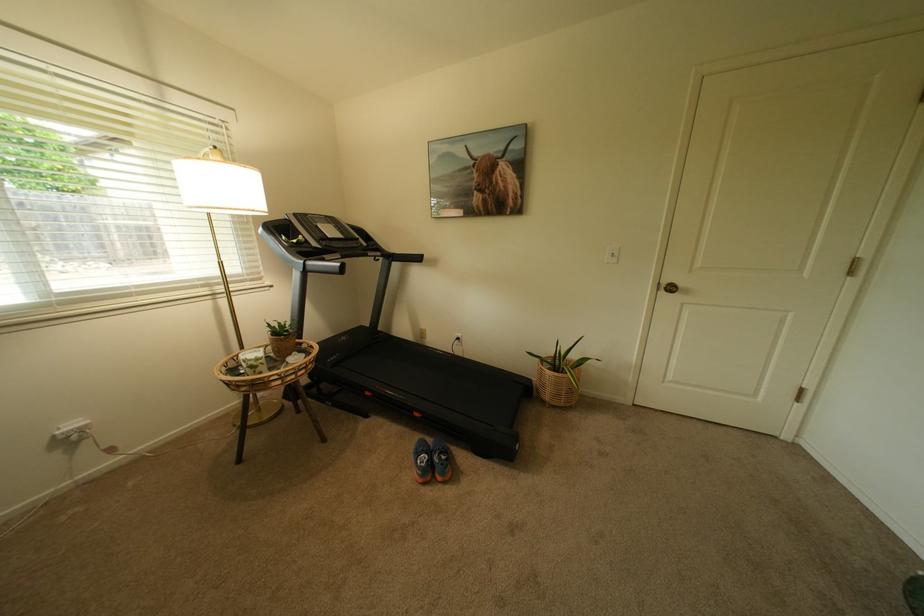
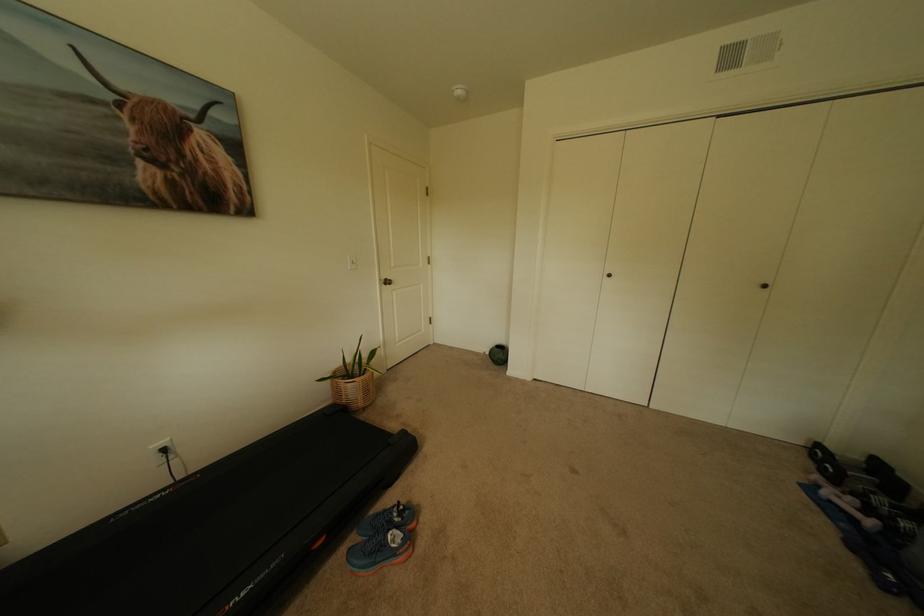
Locate, in the second image, the point that corresponds to (x=557, y=391) in the first image.

(370, 395)